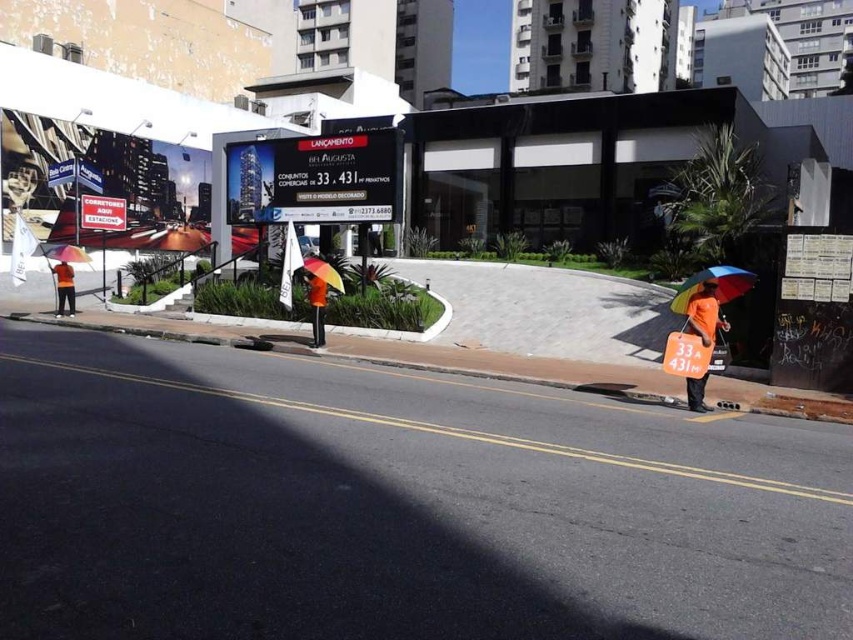
You are standing at the origin point of the image coordinate system. You want to walk to the orange fabric umbrella at lower right. Which direction should you move in terms of x and y coordinates?

The orange fabric umbrella at lower right is located at coordinates x 0.492 and y 0.828. Since you are at the origin, you need to move in the positive x and positive y directions to reach it.